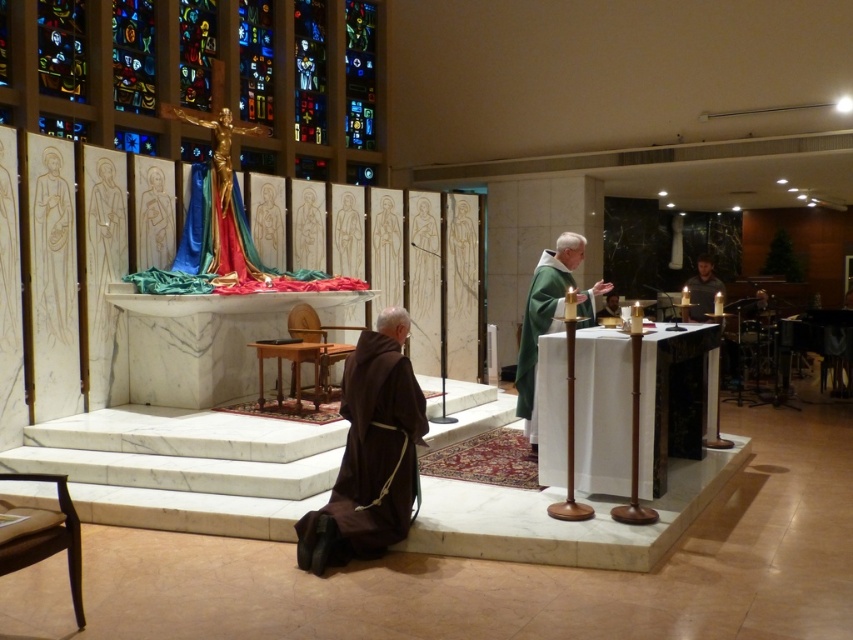
Question: Does wooden carving of person at upper left appear on the left side of matte gold statue at center?

Choices:
 (A) no
 (B) yes

Answer: (B)

Question: Which object is closer to the camera taking this photo?

Choices:
 (A) white marble statue at upper left
 (B) wooden carving of person at upper left

Answer: (A)

Question: Can you confirm if brown cloth at lower left is positioned below matte gold statue at center?

Choices:
 (A) no
 (B) yes

Answer: (B)

Question: Estimate the real-world distances between objects in this image. Which object is closer to the matte gold statue at center?

Choices:
 (A) brown cloth at lower left
 (B) smooth gold statue at center

Answer: (B)

Question: Can you confirm if green cloth at right is bigger than matte gold statue at center?

Choices:
 (A) no
 (B) yes

Answer: (B)

Question: Which point is farther to the camera?

Choices:
 (A) (537, 291)
 (B) (393, 531)

Answer: (A)